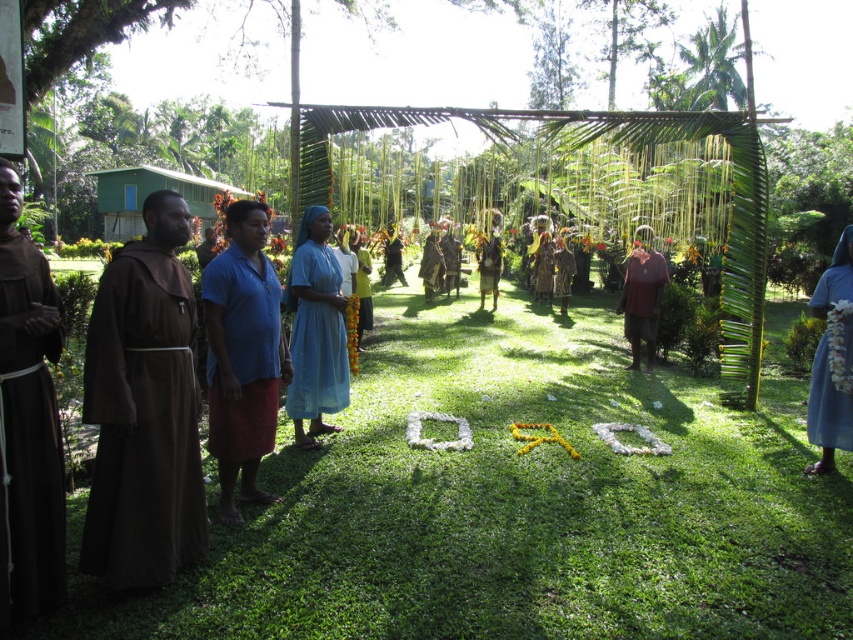
You are standing at the back of the group and want to approach the two men in brown robes. Which point, point (x=334, y=282) or point (x=393, y=264), is closer to you?

Point (x=393, y=264) is closer to you because it is behind point (x=334, y=282).

You are standing at the point marked as point [563,291] and want to walk to the ceremonial area located 15.38 meters away. Is there any obstruction between you and the ceremonial area?

The distance between you and the ceremonial area is 15.38 meters, but there are no obstructions mentioned in the scene description, so you can proceed safely.